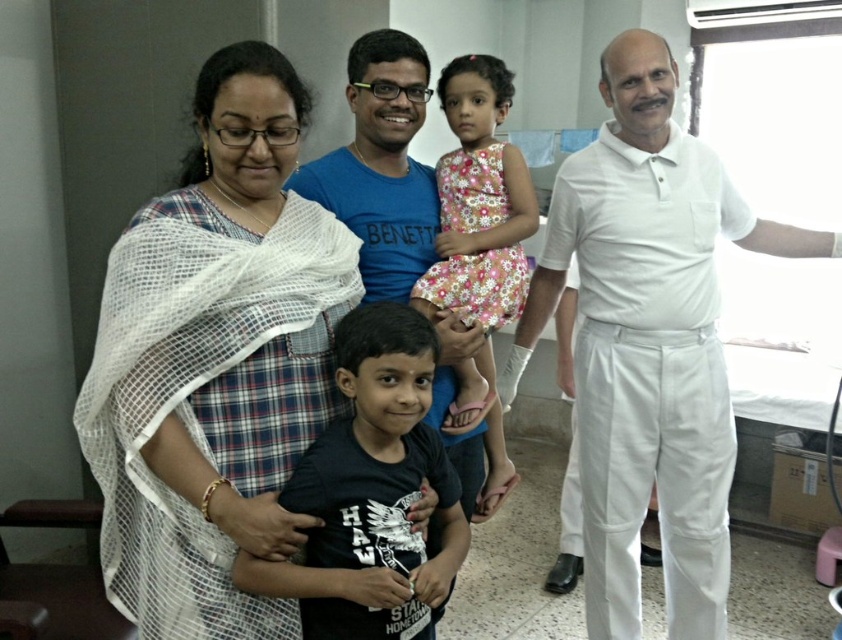
Which is more to the right, white cotton shirt at right or black matte shirt at center?

white cotton shirt at right is more to the right.

Who is more distant from viewer, (617, 573) or (324, 637)?

Point (617, 573)

Does point (701, 524) lie behind point (416, 394)?

That is True.

This screenshot has width=842, height=640. Identify the location of white cotton shirt at right. (649, 342).

Between point (253, 67) and point (514, 186), which one is positioned behind?

Positioned behind is point (514, 186).

Can you confirm if white plaid saree at left is bigger than floral dress at center?

Indeed, white plaid saree at left has a larger size compared to floral dress at center.

At what (x,y) coordinates should I click in order to perform the action: click on white plaid saree at left. Please return your answer as a coordinate pair (x, y). Looking at the image, I should click on click(x=216, y=362).

Find the location of `white plaid saree at left`. white plaid saree at left is located at coordinates tap(216, 362).

The width and height of the screenshot is (842, 640). What do you see at coordinates (382, 164) in the screenshot?
I see `blue cotton t-shirt at center` at bounding box center [382, 164].

This screenshot has height=640, width=842. What are the coordinates of `blue cotton t-shirt at center` in the screenshot? It's located at (382, 164).

Which is behind, point (464, 477) or point (493, 429)?

Positioned behind is point (493, 429).

At what (x,y) coordinates should I click in order to perform the action: click on blue cotton t-shirt at center. Please return your answer as a coordinate pair (x, y). This screenshot has width=842, height=640. Looking at the image, I should click on (382, 164).